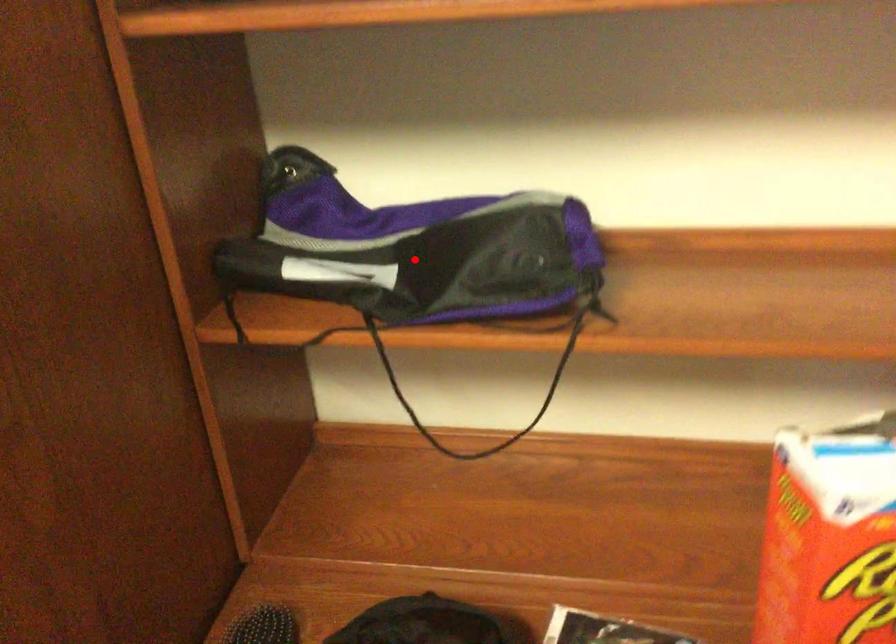
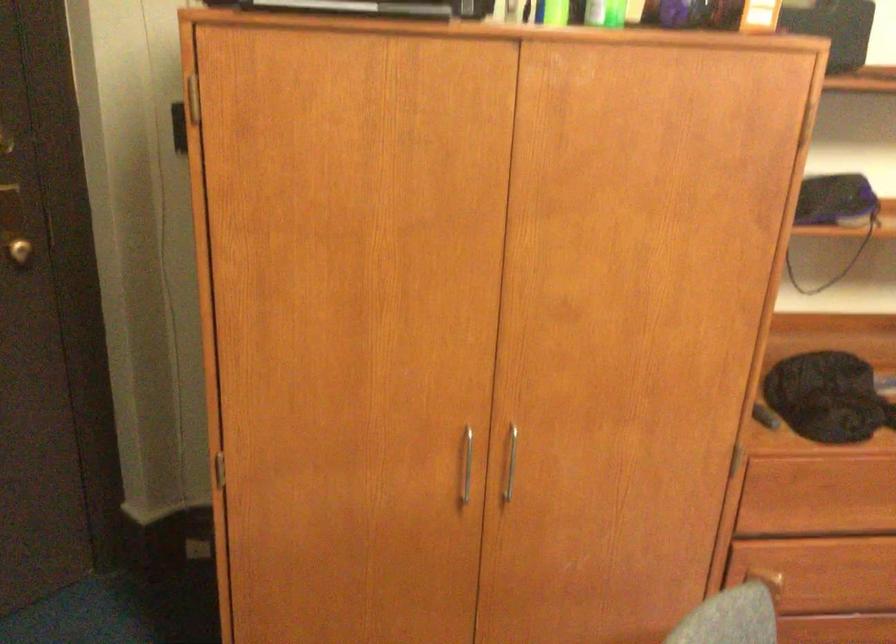
Question: I am providing you with two images of the same scene from different viewpoints. A red point is marked on the first image. Can you still see the location of the red point in image 2?

Choices:
 (A) Yes
 (B) No

Answer: (B)